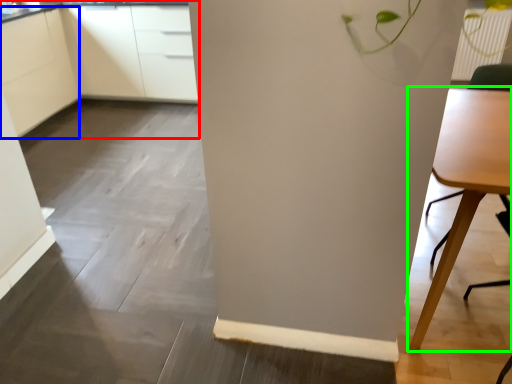
Question: Considering the real-world distances, which object is closest to cabinetry (highlighted by a red box)? cabinetry (highlighted by a blue box) or table (highlighted by a green box).

Choices:
 (A) cabinetry
 (B) table

Answer: (A)